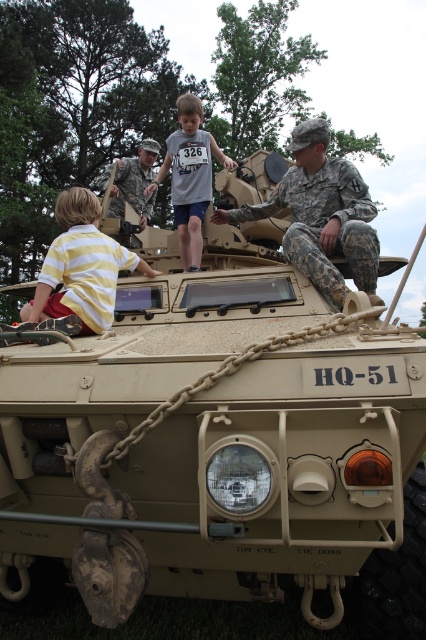
Question: Is camouflage fabric soldier at upper center wider than yellow striped shirt at left?

Choices:
 (A) no
 (B) yes

Answer: (B)

Question: Can you confirm if camouflage fabric soldier at upper center is positioned below gray cotton shirt at center?

Choices:
 (A) yes
 (B) no

Answer: (A)

Question: Where is camouflage fabric soldier at upper center located in relation to yellow striped shirt at left in the image?

Choices:
 (A) left
 (B) right

Answer: (B)

Question: Which object is farther from the camera taking this photo?

Choices:
 (A) camouflage uniform at upper center
 (B) gray cotton shirt at center
 (C) yellow striped shirt at left
 (D) camouflage fabric soldier at upper center

Answer: (A)

Question: Which point is closer to the camera?

Choices:
 (A) tap(353, 275)
 (B) tap(178, 193)

Answer: (A)

Question: Estimate the real-world distances between objects in this image. Which object is farther from the gray cotton shirt at center?

Choices:
 (A) yellow striped shirt at left
 (B) camouflage fabric soldier at upper center
 (C) camouflage uniform at upper center

Answer: (C)